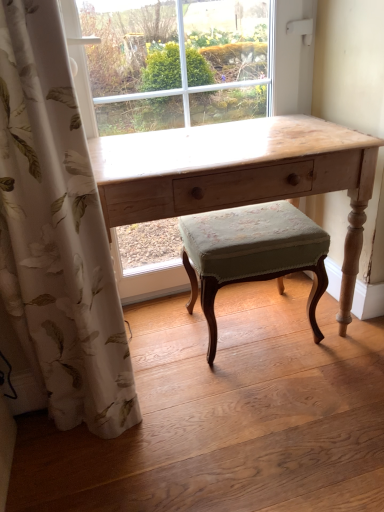
Identify the location of vacant area in front of green fabric stool at center. The height and width of the screenshot is (512, 384). (275, 398).